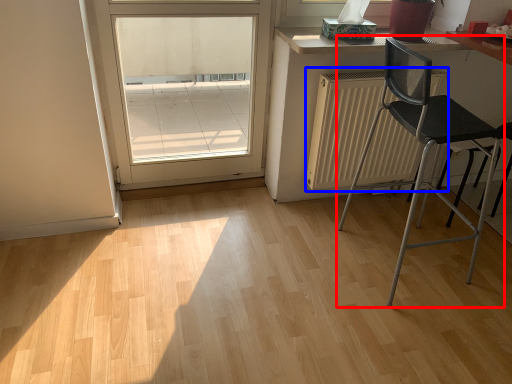
Question: Which object appears closest to the camera in this image, chair (highlighted by a red box) or radiator (highlighted by a blue box)?

Choices:
 (A) chair
 (B) radiator

Answer: (A)